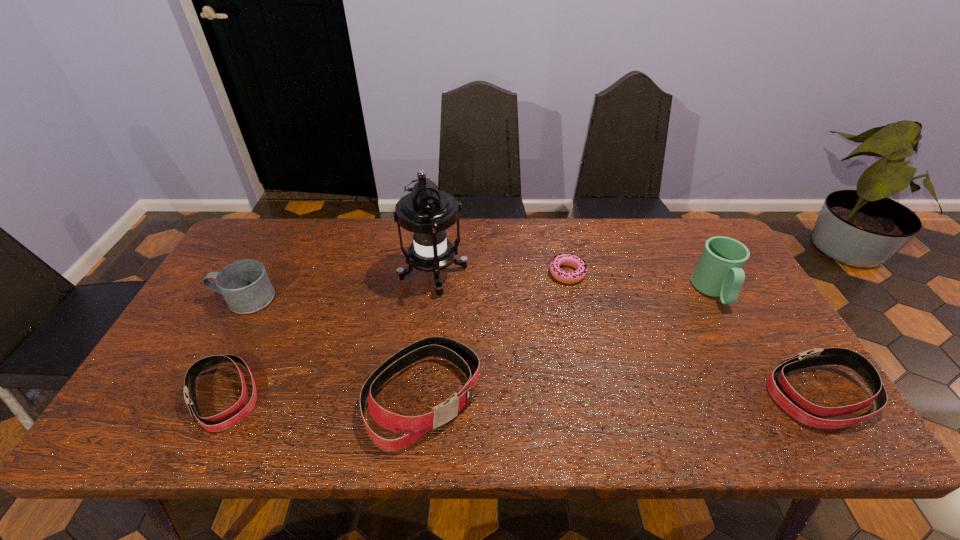
Image resolution: width=960 pixels, height=540 pixels. What are the coordinates of `vacant region at the far right corner of the desktop` in the screenshot? It's located at (674, 241).

At what (x,y) coordinates should I click in order to perform the action: click on vacant area between the rightmost dog collar and the right mug. Please return your answer as a coordinate pair (x, y). The width and height of the screenshot is (960, 540). Looking at the image, I should click on (767, 343).

At what (x,y) coordinates should I click in order to perform the action: click on free space between the shorter mug and the leftmost dog collar. Please return your answer as a coordinate pair (x, y). Looking at the image, I should click on (234, 348).

Where is `free space between the second shortest object and the shortest object`? free space between the second shortest object and the shortest object is located at coordinates (396, 335).

Locate an element on the screen. The height and width of the screenshot is (540, 960). free point between the rightmost dog collar and the leftmost dog collar is located at coordinates (522, 395).

Where is `vacant space that's between the shortest object and the tallest dog collar`? The height and width of the screenshot is (540, 960). vacant space that's between the shortest object and the tallest dog collar is located at coordinates (495, 334).

This screenshot has width=960, height=540. Find the location of `vacant point located between the second dog collar from right to left and the rightmost dog collar`. vacant point located between the second dog collar from right to left and the rightmost dog collar is located at coordinates (622, 395).

Locate an element on the screen. The width and height of the screenshot is (960, 540). free spot between the tallest object and the doughnut is located at coordinates (500, 274).

This screenshot has height=540, width=960. I want to click on free point between the doughnut and the second dog collar from left to right, so click(495, 334).

At what (x,y) coordinates should I click in order to perform the action: click on empty space between the left mug and the rightmost dog collar. Please return your answer as a coordinate pair (x, y). The image size is (960, 540). Looking at the image, I should click on (533, 347).